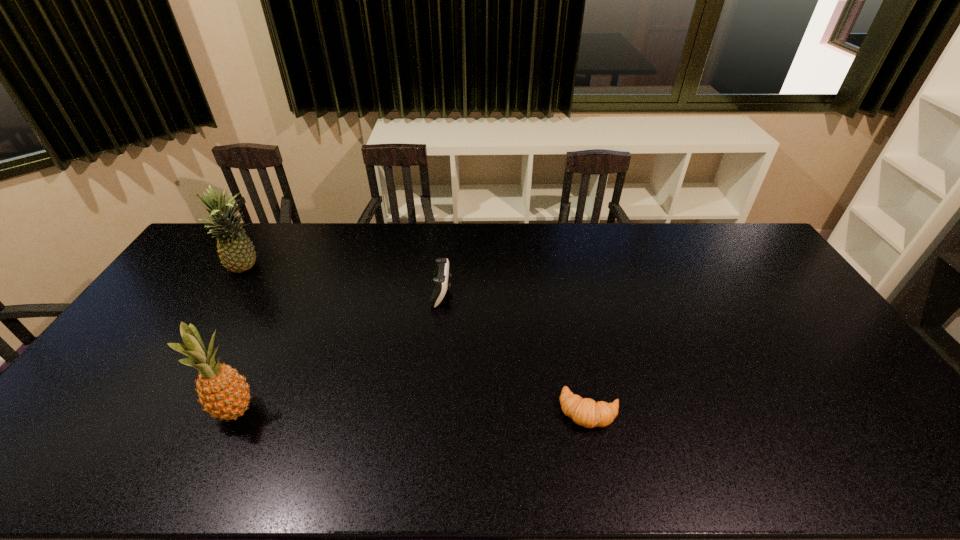
Find the location of a particular element. free area in between the right pineapple and the left pineapple is located at coordinates (240, 340).

I want to click on free space between the leftmost object and the right pineapple, so click(240, 340).

Identify the location of empty space that is in between the third object from left to right and the crescent roll. The image size is (960, 540). (516, 352).

Identify the location of vacant area that lies between the leftmost object and the shortest object. coord(418,340).

The height and width of the screenshot is (540, 960). Find the location of `free spot between the rightmost object and the left pineapple`. free spot between the rightmost object and the left pineapple is located at coordinates (418, 340).

Identify the location of unoccupied position between the shortest object and the second object from left to right. This screenshot has width=960, height=540. tap(413, 411).

What are the coordinates of `free area in between the shortest object and the second shortest object` in the screenshot? It's located at (516, 352).

Where is `vacant area that lies between the second object from left to right and the second shortest object`? vacant area that lies between the second object from left to right and the second shortest object is located at coordinates (339, 352).

Image resolution: width=960 pixels, height=540 pixels. Find the location of `free area in between the nearer pineapple and the farther pineapple`. free area in between the nearer pineapple and the farther pineapple is located at coordinates (240, 340).

Locate an element on the screen. Image resolution: width=960 pixels, height=540 pixels. object that stands as the second closest to the shortest object is located at coordinates (223, 393).